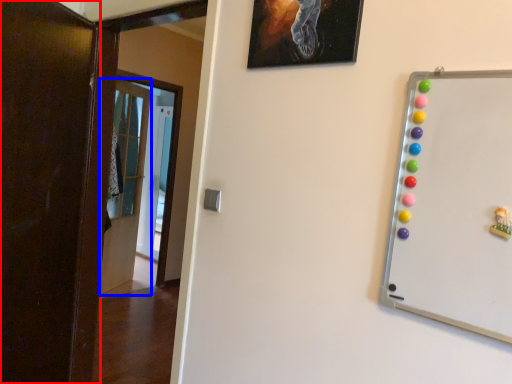
Question: Which object is closer to the camera taking this photo, door (highlighted by a red box) or door (highlighted by a blue box)?

Choices:
 (A) door
 (B) door

Answer: (A)